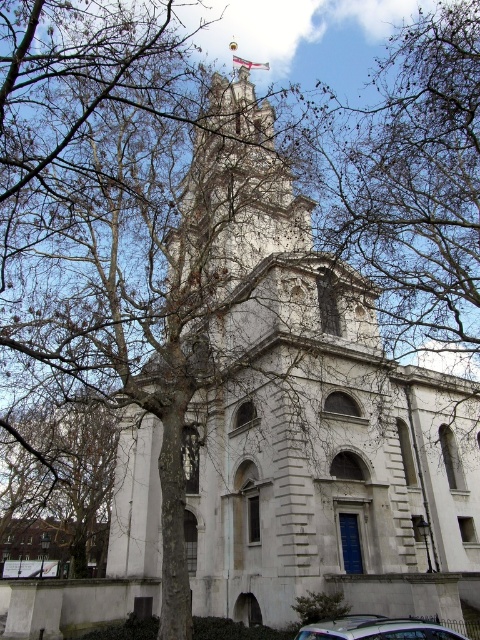
You are standing at the base of the historic church and notice two points marked on the facade. The first point is at coordinate point (206, 557) and the second is at point (96, 458). Which of these two points is closer to you?

Result: Point (206, 557) is in front of point (96, 458), so it is closer to you.

You are an architect analyzing the symmetry of the historic building. You notice the brown bark tree at left and the white fabric flag at upper center. Which object occupies a larger area in the image?

The brown bark tree at left is bigger than the white fabric flag at upper center, so it occupies a larger area in the image.